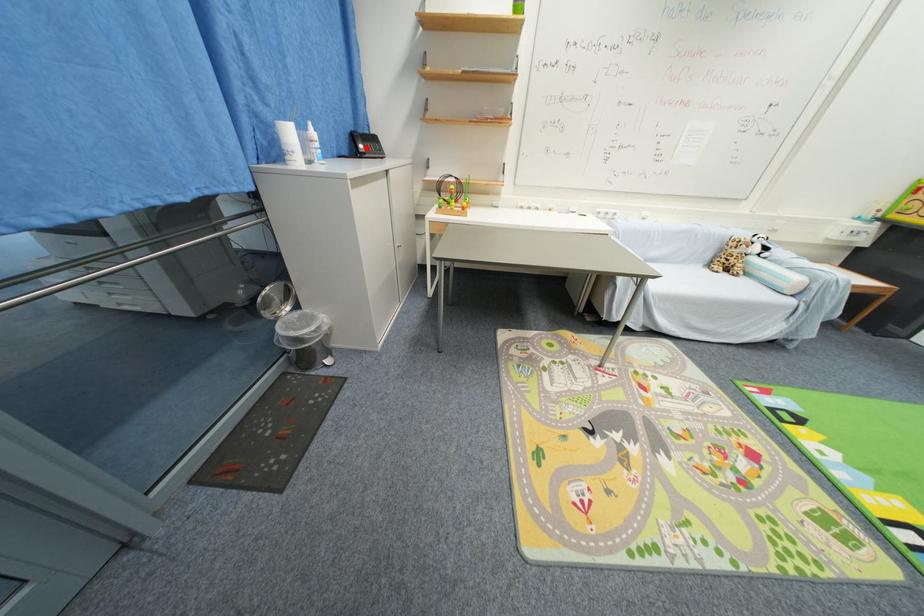
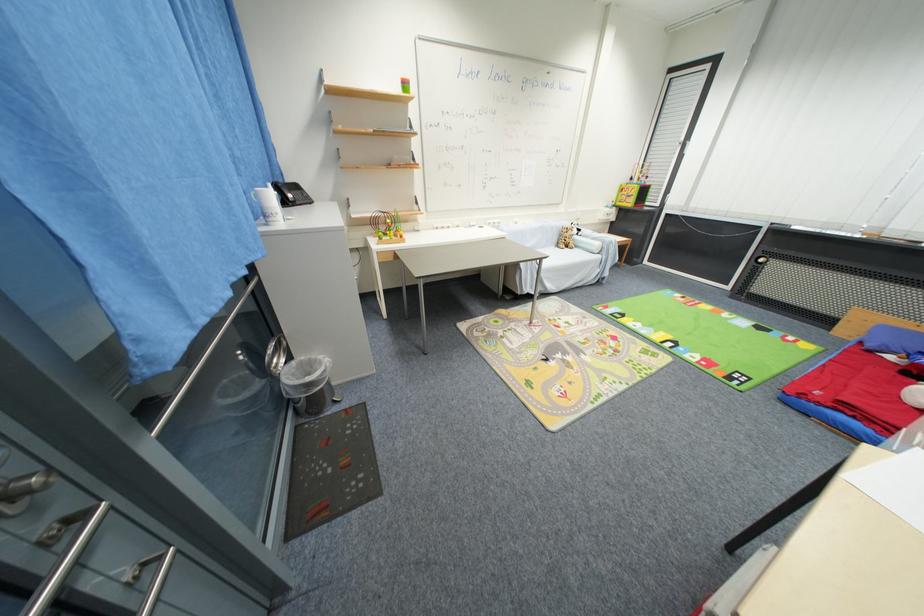
The point at the highlighted location is marked in the first image. Where is the corresponding point in the second image?

(296, 198)